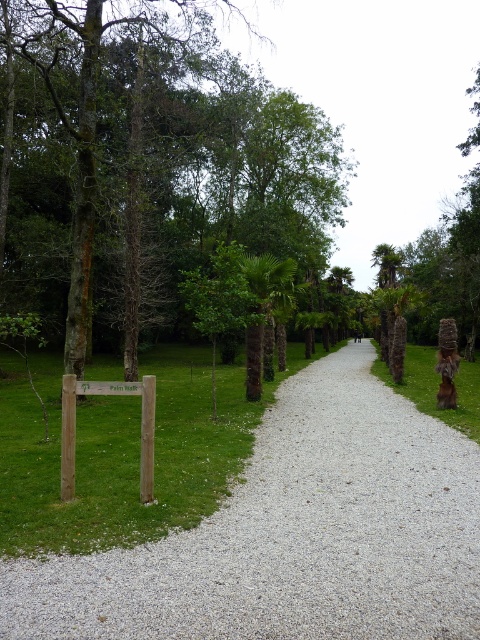
Which is in front, point (442, 413) or point (151, 484)?

Point (151, 484) is more forward.

Can you confirm if green grass at right is wider than wooden signpost at center?

Yes, green grass at right is wider than wooden signpost at center.

Locate an element on the screen. green grass at right is located at coordinates (437, 387).

Who is lower down, gray gravel at center or wooden signpost at center?

gray gravel at center is lower down.

The height and width of the screenshot is (640, 480). What do you see at coordinates (292, 534) in the screenshot?
I see `gray gravel at center` at bounding box center [292, 534].

Identify the location of gray gravel at center. (292, 534).

Which of these two, gray gravel at center or green grass at right, stands shorter?

gray gravel at center is shorter.

Is point (231, 627) more distant than point (471, 365)?

That is False.

What do you see at coordinates (292, 534) in the screenshot? Image resolution: width=480 pixels, height=640 pixels. I see `gray gravel at center` at bounding box center [292, 534].

Find the location of a particular element. This screenshot has width=480, height=640. gray gravel at center is located at coordinates (292, 534).